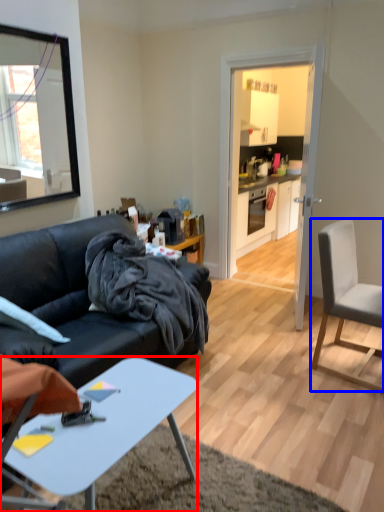
Question: Which object appears closest to the camera in this image, desk (highlighted by a red box) or chair (highlighted by a blue box)?

Choices:
 (A) desk
 (B) chair

Answer: (A)